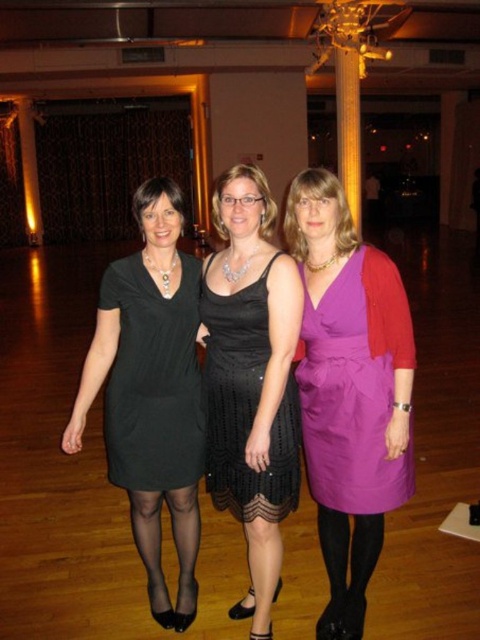
You are a photographer setting up for a group photo. You need to ensure that the purple satin dress at center and the black matte dress at left are both visible in the frame. Based on their positions, which dress is lower in the image?

The purple satin dress at center is below the black matte dress at left, so the purple satin dress at center is lower in the image.

You are standing at the entrance of the room and want to move towards the gold polished column at center. There is a matte black dress at center in your path. Can you walk straight to the column without going around?

The matte black dress at center is 4.13 meters away from the gold polished column at center, so you can walk straight to the column without going around since the distance is sufficient.